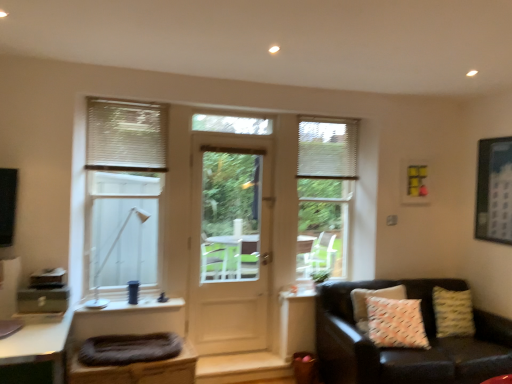
Question: From a real-world perspective, is white textured blinds at upper left, the second shutter when ordered from back to front, physically below white blinds at center, acting as the first window starting from the back?

Choices:
 (A) yes
 (B) no

Answer: (B)

Question: From a real-world perspective, is white textured blinds at upper left, which is the first shutter from front to back, on top of white blinds at center, acting as the first window starting from the back?

Choices:
 (A) no
 (B) yes

Answer: (B)

Question: Is white textured blinds at upper left, the second shutter when ordered from back to front, facing towards white blinds at center, which ranks as the 1th window in right-to-left order?

Choices:
 (A) yes
 (B) no

Answer: (B)

Question: Can you confirm if white textured blinds at upper left, the 2th shutter from the right, is thinner than white blinds at center, acting as the first window starting from the back?

Choices:
 (A) no
 (B) yes

Answer: (B)

Question: Is white textured blinds at upper left, the first shutter when ordered from left to right, positioned beyond the bounds of white blinds at center, the 2th window in the left-to-right sequence?

Choices:
 (A) yes
 (B) no

Answer: (A)

Question: From their relative heights in the image, would you say white plastic lamp at left is taller or shorter than white textured blinds at upper right, acting as the first shutter starting from the back?

Choices:
 (A) short
 (B) tall

Answer: (B)

Question: Looking at their shapes, would you say white plastic lamp at left is wider or thinner than white textured blinds at upper right, the second shutter viewed from the left?

Choices:
 (A) wide
 (B) thin

Answer: (A)

Question: In terms of size, does white plastic lamp at left appear bigger or smaller than white textured blinds at upper right, placed as the second shutter when sorted from front to back?

Choices:
 (A) small
 (B) big

Answer: (B)

Question: Is white plastic lamp at left in front of or behind white textured blinds at upper right, the second shutter viewed from the left, in the image?

Choices:
 (A) behind
 (B) front

Answer: (B)

Question: In the image, is yellow matte picture frame at upper right, the second picture frame in the front-to-back sequence, positioned in front of or behind leather couch with patterned pillows at lower right?

Choices:
 (A) behind
 (B) front

Answer: (A)

Question: In terms of size, does yellow matte picture frame at upper right, the second picture frame in the front-to-back sequence, appear bigger or smaller than leather couch with patterned pillows at lower right?

Choices:
 (A) small
 (B) big

Answer: (A)

Question: Is yellow matte picture frame at upper right, which ranks as the 1th picture frame in left-to-right order, taller or shorter than leather couch with patterned pillows at lower right?

Choices:
 (A) tall
 (B) short

Answer: (B)

Question: From the image's perspective, is yellow matte picture frame at upper right, the second picture frame in the front-to-back sequence, located above or below leather couch with patterned pillows at lower right?

Choices:
 (A) below
 (B) above

Answer: (B)

Question: From a real-world perspective, relative to yellow matte picture frame at upper right, which ranks as the 1th picture frame in left-to-right order, is white textured pillow at right vertically above or below?

Choices:
 (A) above
 (B) below

Answer: (B)

Question: From the image's perspective, is white textured pillow at right positioned above or below yellow matte picture frame at upper right, which appears as the 1th picture frame when viewed from the back?

Choices:
 (A) below
 (B) above

Answer: (A)